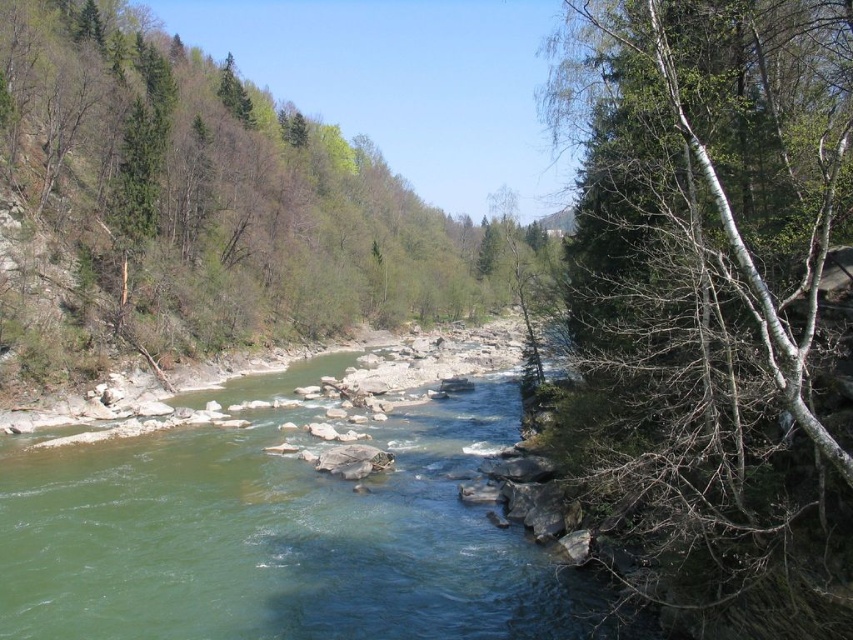
The width and height of the screenshot is (853, 640). Find the location of `white bark tree at right`. white bark tree at right is located at coordinates (712, 305).

This screenshot has height=640, width=853. I want to click on white bark tree at right, so click(712, 305).

Which of these two, white bark tree at right or green leafy tree at center, stands shorter?

white bark tree at right

Which is in front, point (764, 582) or point (18, 332)?

Positioned in front is point (764, 582).

In order to click on white bark tree at right in this screenshot , I will do `click(712, 305)`.

In the scene shown: Does green leafy tree at center have a lesser height compared to green smooth river at center?

No.

At what (x,y) coordinates should I click in order to perform the action: click on green leafy tree at center. Please return your answer as a coordinate pair (x, y). The image size is (853, 640). Looking at the image, I should click on (195, 205).